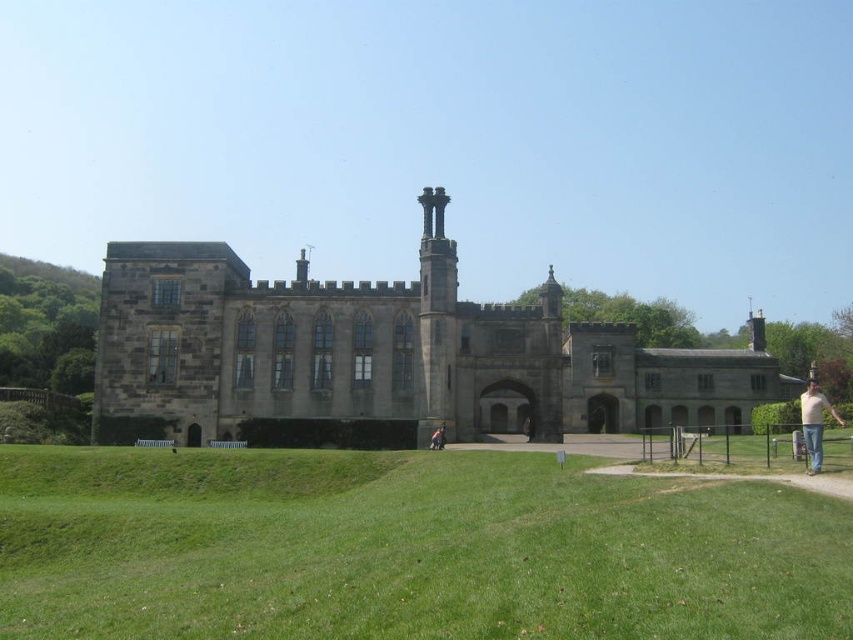
Can you confirm if green grassy at lower center is positioned below light beige jeans at lower right?

Correct, green grassy at lower center is located below light beige jeans at lower right.

Is green grassy at lower center smaller than light beige jeans at lower right?

No.

You are a GUI agent. You are given a task and a screenshot of the screen. Output one action in this format:
    pyautogui.click(x=<x>, y=<y>)
    Task: Click on the green grassy at lower center
    The image size is (853, 640).
    Given the screenshot: What is the action you would take?
    pyautogui.click(x=405, y=548)

What are the coordinates of `green grassy at lower center` in the screenshot? It's located at (405, 548).